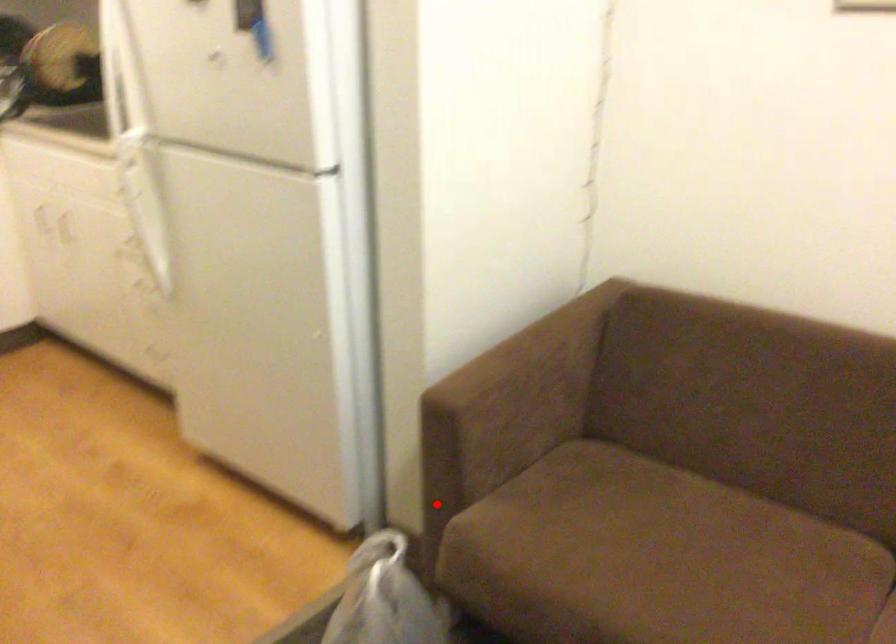
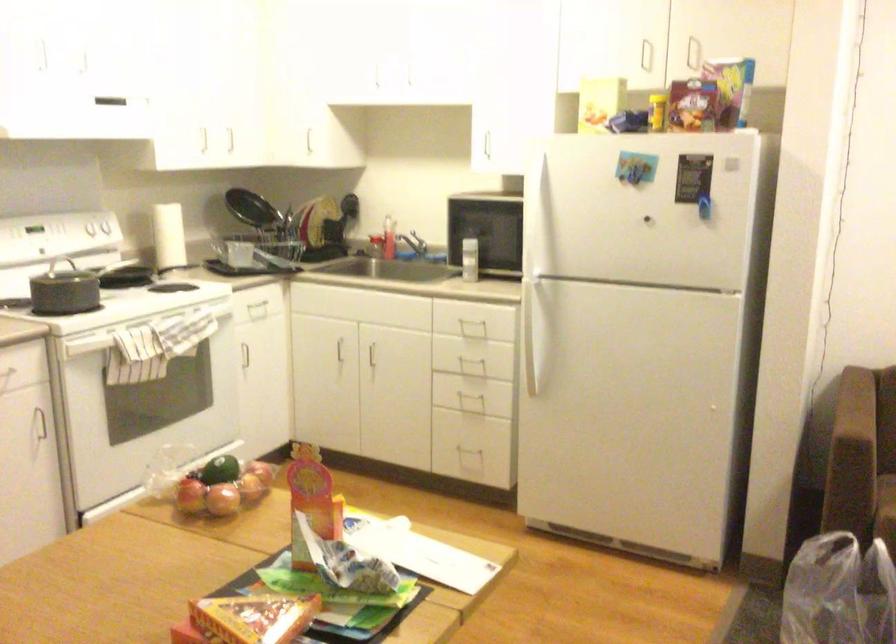
In the second image, find the point that corresponds to the highlighted location in the first image.

(863, 513)